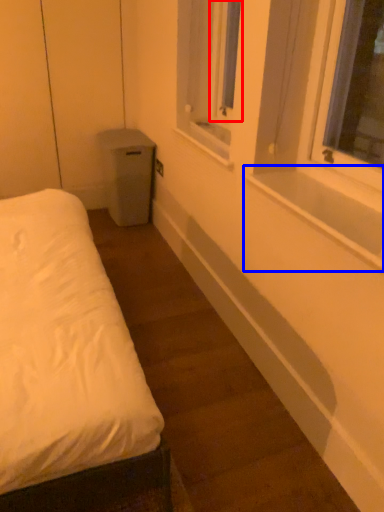
Question: Which point is closer to the camera, window screen (highlighted by a red box) or window sill (highlighted by a blue box)?

Choices:
 (A) window screen
 (B) window sill

Answer: (B)